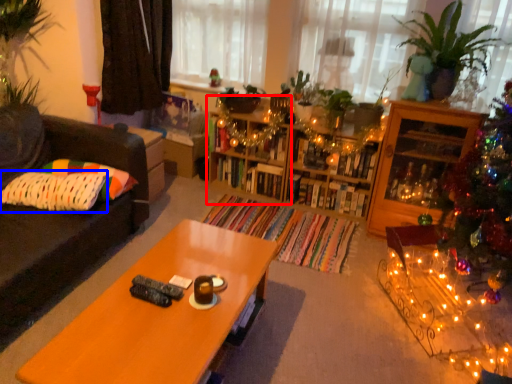
Question: Which of the following is the farthest to the observer, shelf (highlighted by a red box) or pillow (highlighted by a blue box)?

Choices:
 (A) shelf
 (B) pillow

Answer: (A)